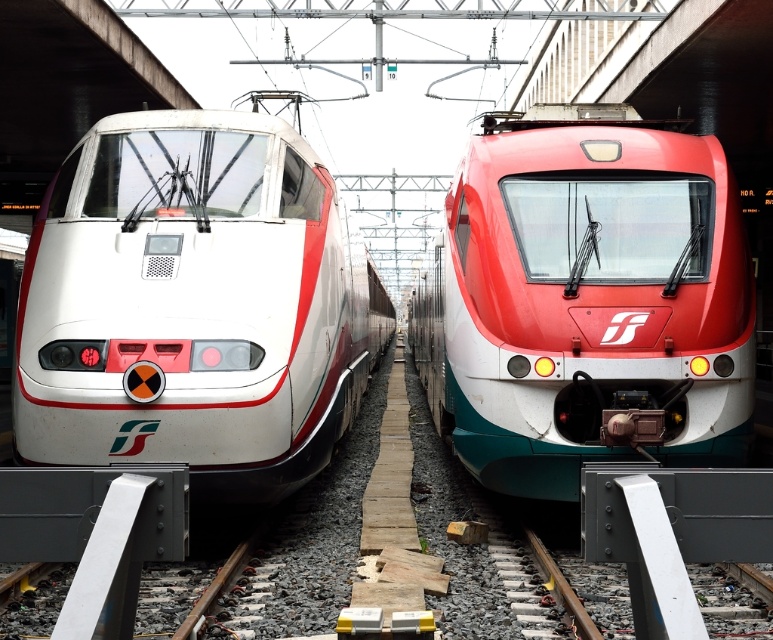
Question: Which point is farther from the camera taking this photo?

Choices:
 (A) (261, 243)
 (B) (508, 465)

Answer: (B)

Question: Does white glossy train at left have a smaller size compared to matte red train at center?

Choices:
 (A) no
 (B) yes

Answer: (B)

Question: Does white glossy train at left appear under matte red train at center?

Choices:
 (A) yes
 (B) no

Answer: (B)

Question: Is white glossy train at left smaller than matte red train at center?

Choices:
 (A) yes
 (B) no

Answer: (A)